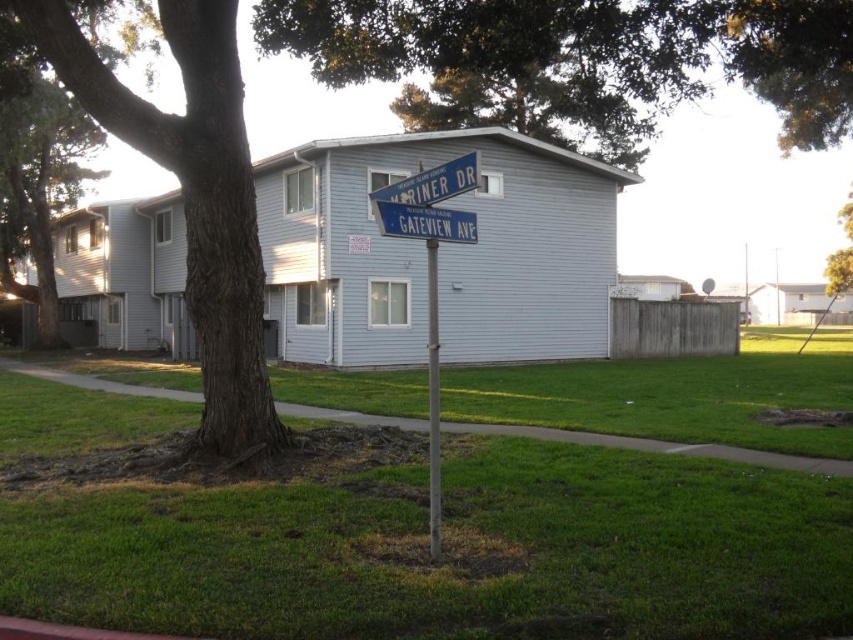
Consider the image. How distant is green textured tree at left from yellow leafy tree at upper right?

green textured tree at left and yellow leafy tree at upper right are 49.36 meters apart.

In the scene shown: Between green textured tree at left and yellow leafy tree at upper right, which one has more height?

Standing taller between the two is yellow leafy tree at upper right.

Which is in front, point (33, 109) or point (828, 275)?

Point (33, 109) is more forward.

This screenshot has height=640, width=853. I want to click on green textured tree at left, so click(39, 186).

Is blue plastic street sign at center further to camera compared to yellow leafy tree at upper right?

That is False.

Is blue plastic street sign at center above yellow leafy tree at upper right?

Actually, blue plastic street sign at center is below yellow leafy tree at upper right.

What are the coordinates of `blue plastic street sign at center` in the screenshot? It's located at (424, 221).

Image resolution: width=853 pixels, height=640 pixels. Find the location of `blue plastic street sign at center`. blue plastic street sign at center is located at coordinates (424, 221).

How distant is green grass at center from metallic pole at center?

green grass at center is 4.16 meters away from metallic pole at center.

Based on the photo, who is more forward, (817,378) or (431,456)?

Positioned in front is point (431,456).

Identify the location of green grass at center. Image resolution: width=853 pixels, height=640 pixels. (450, 552).